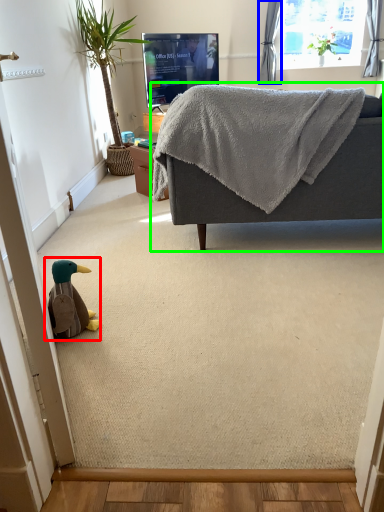
Question: Which is nearer to the toy (highlighted by a red box)? curtain (highlighted by a blue box) or studio couch (highlighted by a green box).

Choices:
 (A) curtain
 (B) studio couch

Answer: (B)